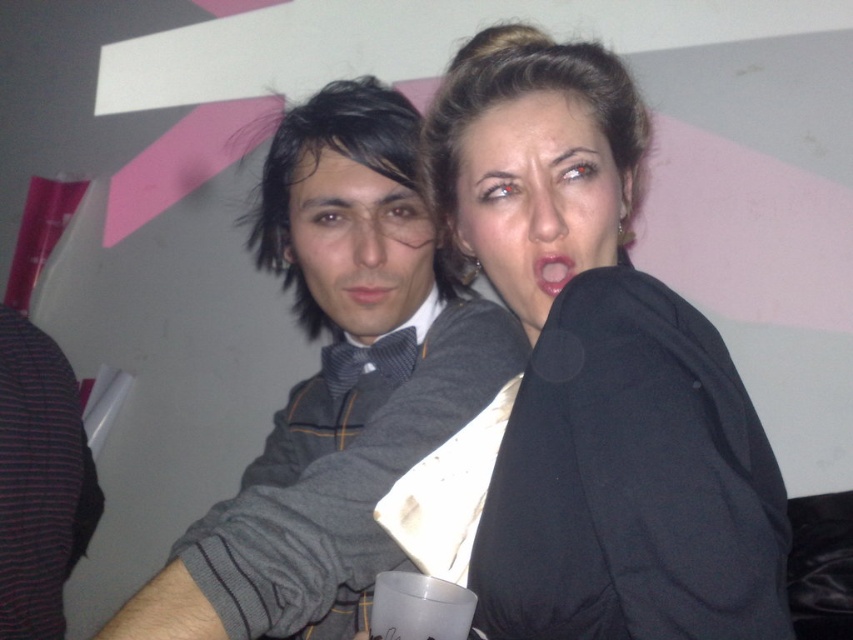
Question: Does matte black bow tie at center have a smaller size compared to matte gray bow tie at center?

Choices:
 (A) yes
 (B) no

Answer: (B)

Question: Which object is positioned farthest from the matte black bow tie at center?

Choices:
 (A) matte black hair at center
 (B) matte gray bow tie at center
 (C) pink matte lips at center
 (D) gray striped sweater at center

Answer: (C)

Question: Is matte black hair at center closer to camera compared to matte black bow tie at center?

Choices:
 (A) yes
 (B) no

Answer: (A)

Question: Which point is farther from the camera taking this photo?

Choices:
 (A) (341, 300)
 (B) (548, 273)

Answer: (A)

Question: Does black matte jacket at upper right have a lesser width compared to gray striped sweater at center?

Choices:
 (A) yes
 (B) no

Answer: (A)

Question: Which object is positioned farthest from the pink matte lips at center?

Choices:
 (A) black matte jacket at upper right
 (B) gray striped sweater at center

Answer: (B)